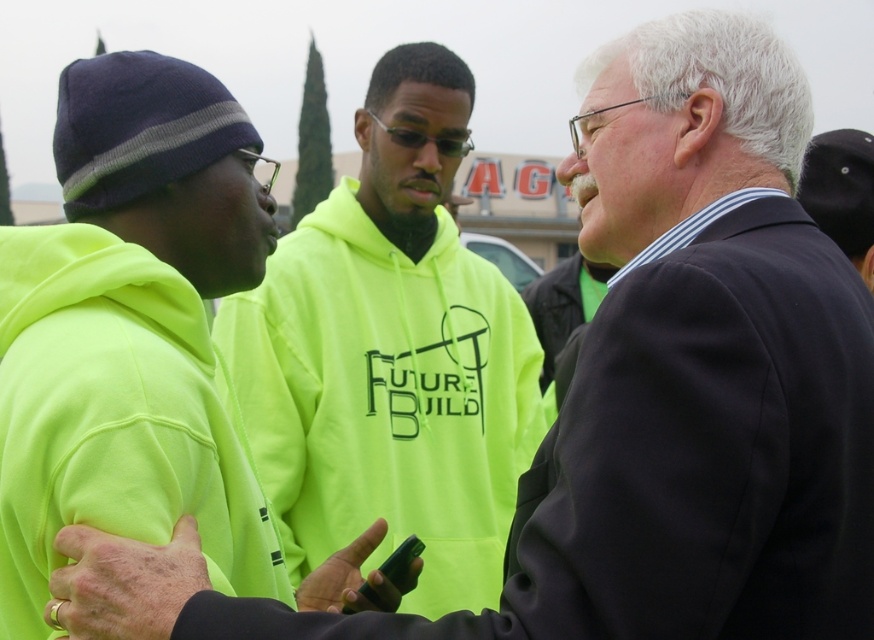
Can you confirm if neon yellow hoodie at center is thinner than green matte phone at center?

Indeed, neon yellow hoodie at center has a lesser width compared to green matte phone at center.

Can you confirm if neon yellow hoodie at center is wider than green matte phone at center?

No.

Who is more forward, (489,464) or (383,608)?

Point (383,608) is more forward.

The image size is (874, 640). I want to click on neon yellow hoodie at center, so click(x=392, y=355).

Does matte yellow-green sleeve at center come in front of green matte phone at center?

Yes.

Can you confirm if matte yellow-green sleeve at center is thinner than green matte phone at center?

No.

Image resolution: width=874 pixels, height=640 pixels. Identify the location of matte yellow-green sleeve at center. (x=123, y=582).

Identify the location of matte yellow-green sleeve at center. This screenshot has width=874, height=640. (123, 582).

From the picture: Which is more to the left, neon yellow hoodie at center or matte yellow-green sleeve at center?

matte yellow-green sleeve at center

Find the location of a particular element. neon yellow hoodie at center is located at coordinates (392, 355).